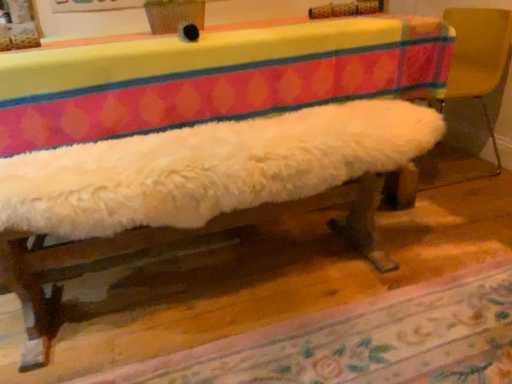
The height and width of the screenshot is (384, 512). Find the location of `vacant space that's between white fluffy cushion at right and floral carpet at lower center`. vacant space that's between white fluffy cushion at right and floral carpet at lower center is located at coordinates (347, 256).